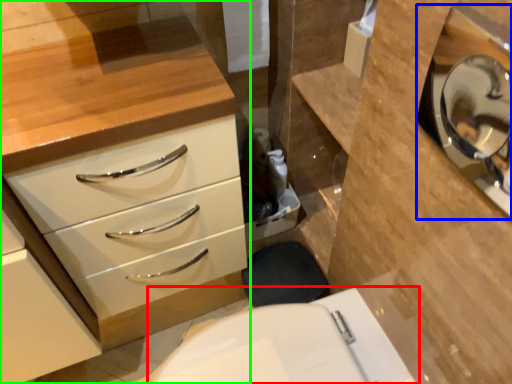
Question: Based on their relative distances, which object is farther from toilet (highlighted by a red box)? Choose from medicine cabinet (highlighted by a blue box) and chest of drawers (highlighted by a green box).

Choices:
 (A) medicine cabinet
 (B) chest of drawers

Answer: (A)